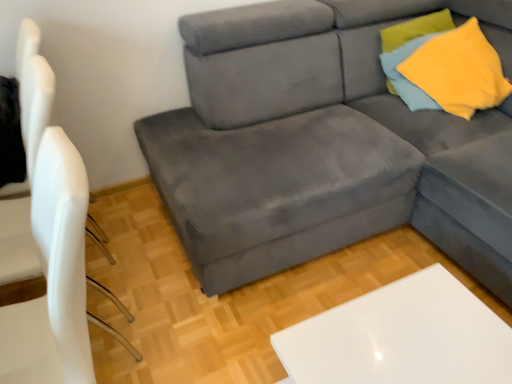
Question: Considering the relative sizes of velvet gray couch at center and white matte chair at left in the image provided, is velvet gray couch at center taller than white matte chair at left?

Choices:
 (A) no
 (B) yes

Answer: (A)

Question: Does velvet gray couch at center turn towards white matte chair at left?

Choices:
 (A) no
 (B) yes

Answer: (B)

Question: Is velvet gray couch at center directly adjacent to white matte chair at left?

Choices:
 (A) yes
 (B) no

Answer: (B)

Question: Is velvet gray couch at center far away from white matte chair at left?

Choices:
 (A) no
 (B) yes

Answer: (B)

Question: From the image's perspective, is velvet gray couch at center beneath white matte chair at left?

Choices:
 (A) no
 (B) yes

Answer: (A)

Question: Is velvet gray couch at center at the left side of white matte chair at left?

Choices:
 (A) no
 (B) yes

Answer: (A)

Question: Could you tell me if yellow soft fabric pillow at upper right is facing velvet gray couch at center?

Choices:
 (A) yes
 (B) no

Answer: (A)

Question: Is yellow soft fabric pillow at upper right completely or partially outside of velvet gray couch at center?

Choices:
 (A) yes
 (B) no

Answer: (B)

Question: Is yellow soft fabric pillow at upper right bigger than velvet gray couch at center?

Choices:
 (A) yes
 (B) no

Answer: (B)

Question: Considering the relative sizes of yellow soft fabric pillow at upper right and velvet gray couch at center in the image provided, is yellow soft fabric pillow at upper right wider than velvet gray couch at center?

Choices:
 (A) no
 (B) yes

Answer: (A)

Question: Would you say yellow soft fabric pillow at upper right contains velvet gray couch at center?

Choices:
 (A) yes
 (B) no

Answer: (B)

Question: Considering the relative positions of yellow soft fabric pillow at upper right and velvet gray couch at center in the image provided, is yellow soft fabric pillow at upper right in front of velvet gray couch at center?

Choices:
 (A) no
 (B) yes

Answer: (A)

Question: Does white matte chair at left contain velvet gray couch at center?

Choices:
 (A) yes
 (B) no

Answer: (B)